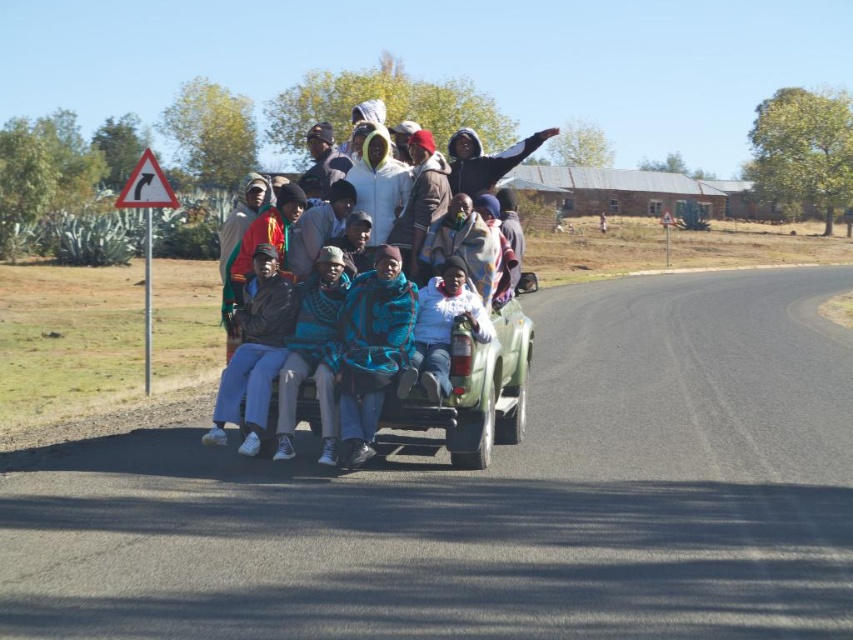
Between multicolored woven blanket at center and white fleece jacket at center, which one appears on the right side from the viewer's perspective?

white fleece jacket at center is more to the right.

What do you see at coordinates (437, 269) in the screenshot? I see `multicolored woven blanket at center` at bounding box center [437, 269].

The height and width of the screenshot is (640, 853). Identify the location of multicolored woven blanket at center. click(437, 269).